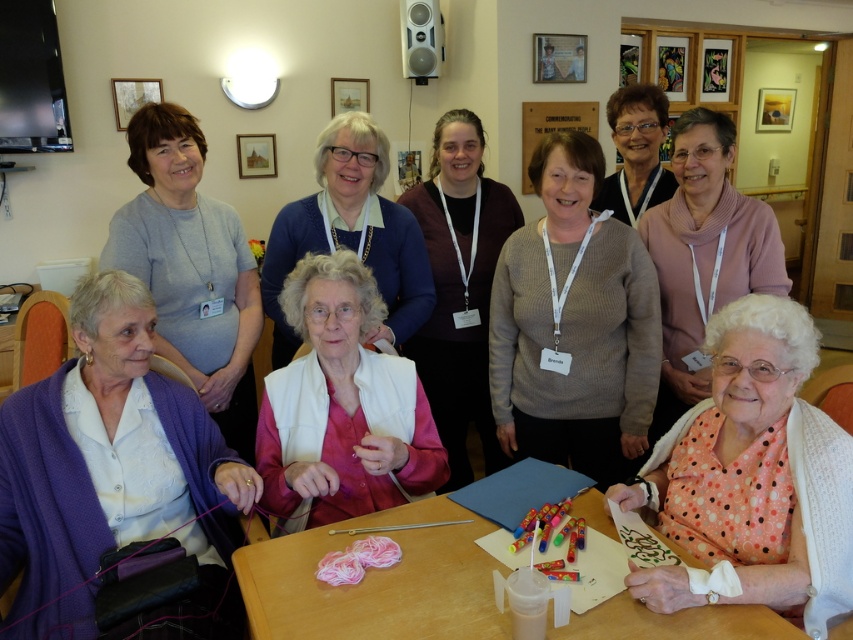
Question: Does purple soft sweater at lower left lie in front of wooden table at lower center?

Choices:
 (A) yes
 (B) no

Answer: (B)

Question: Among these objects, which one is nearest to the camera?

Choices:
 (A) white matte vest at center
 (B) knitted beige sweater at center

Answer: (A)

Question: Is pink dotted sweater at lower right positioned at the back of pink woolen sweater at center?

Choices:
 (A) yes
 (B) no

Answer: (A)

Question: Which of the following is the closest to the observer?

Choices:
 (A) knitted beige sweater at center
 (B) purple soft sweater at lower left

Answer: (B)

Question: Does knitted beige sweater at center appear on the right side of white matte vest at center?

Choices:
 (A) no
 (B) yes

Answer: (B)

Question: Which of the following is the closest to the observer?

Choices:
 (A) (381, 164)
 (B) (675, 472)
 (C) (706, 225)
 (D) (659, 109)

Answer: (B)